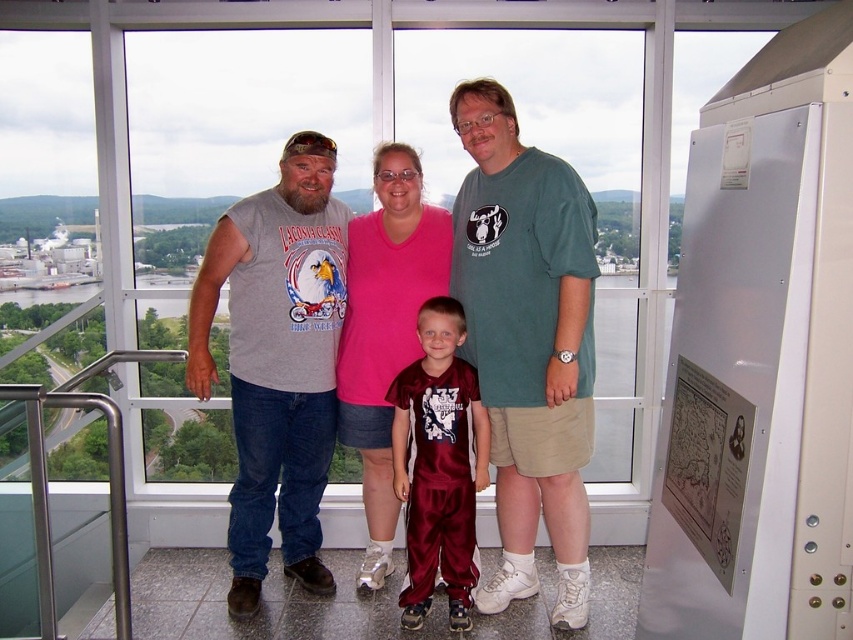
Does gray sleeveless shirt at center have a greater height compared to maroon satin pants at center?

Yes.

From the picture: Between gray sleeveless shirt at center and maroon satin pants at center, which one is positioned higher?

gray sleeveless shirt at center is above.

Between point (253, 285) and point (456, 532), which one is positioned in front?

Positioned in front is point (253, 285).

Where is `gray sleeveless shirt at center`? This screenshot has height=640, width=853. gray sleeveless shirt at center is located at coordinates (277, 360).

Which is behind, point (265, 49) or point (445, 248)?

Positioned behind is point (265, 49).

Between transparent glass window at center and maroon jersey at center, which one has less height?

With less height is maroon jersey at center.

Who is more forward, (200, 445) or (370, 467)?

Point (370, 467) is in front.

This screenshot has height=640, width=853. What are the coordinates of `transparent glass window at center` in the screenshot? It's located at (233, 125).

Is green cotton t-shirt at center below gray sleeveless shirt at center?

Actually, green cotton t-shirt at center is above gray sleeveless shirt at center.

You are a GUI agent. You are given a task and a screenshot of the screen. Output one action in this format:
    pyautogui.click(x=<x>, y=<y>)
    Task: Click on the green cotton t-shirt at center
    
    Given the screenshot: What is the action you would take?
    pyautogui.click(x=527, y=340)

Find the location of a particular element. green cotton t-shirt at center is located at coordinates (527, 340).